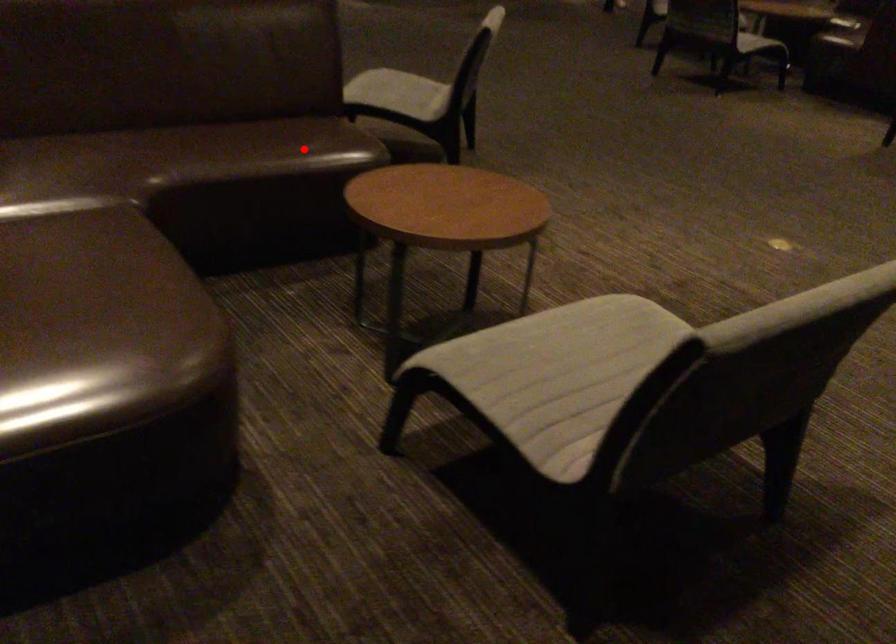
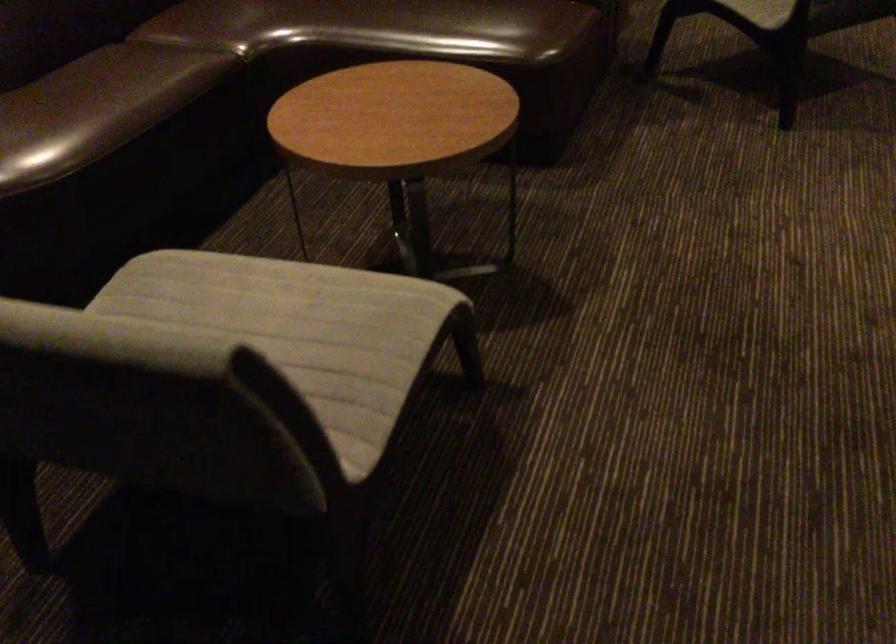
Find the pixel in the second image that matches the highlighted location in the first image.

(444, 26)